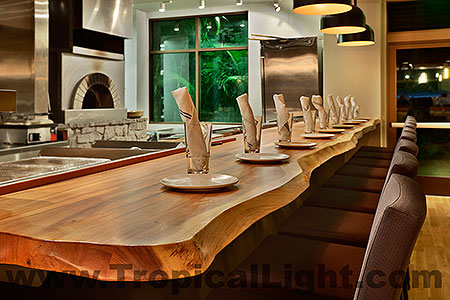
Locate an element on the screen. lamp is located at coordinates (332, 4), (346, 25).